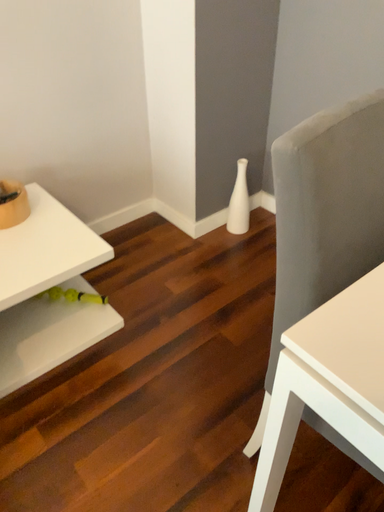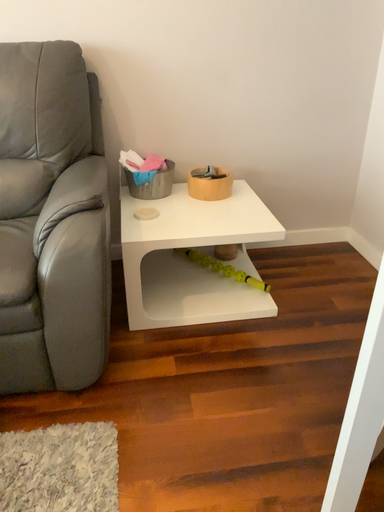
Question: How did the camera likely rotate when shooting the video?

Choices:
 (A) rotated left
 (B) rotated right

Answer: (A)